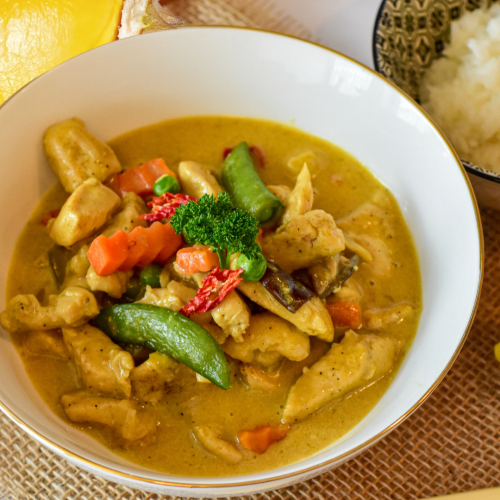
Image resolution: width=500 pixels, height=500 pixels. In order to click on white bowl, porcelain in appearance in this screenshot , I will do `click(184, 97)`.